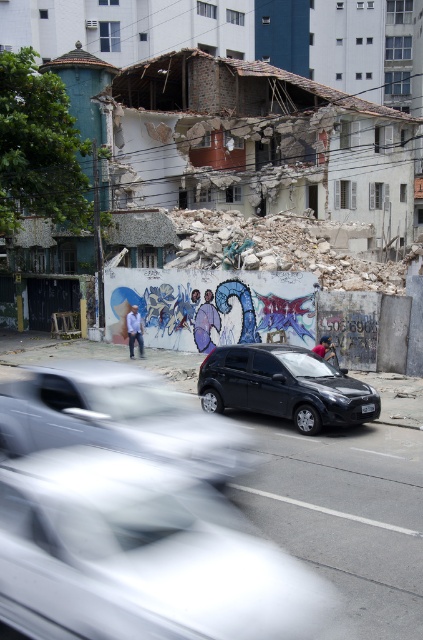
From the picture: Can you confirm if white glossy car at center is positioned to the left of metallic silver car at center?

In fact, white glossy car at center is to the right of metallic silver car at center.

Between point (195, 497) and point (24, 451), which one is positioned behind?

The point (24, 451) is more distant.

Locate an element on the screen. The width and height of the screenshot is (423, 640). white glossy car at center is located at coordinates (140, 557).

Which is in front, point (156, 394) or point (313, 378)?

Point (156, 394) is more forward.

Between metallic silver car at center and black matte hatchback at center, which one has more height?

black matte hatchback at center is taller.

Which is behind, point (132, 448) or point (367, 396)?

The point (367, 396) is more distant.

This screenshot has width=423, height=640. I want to click on metallic silver car at center, so click(x=120, y=419).

Locate an element on the screen. This screenshot has width=423, height=640. white glossy car at center is located at coordinates (140, 557).

Is white glossy car at center in front of black matte hatchback at center?

Yes, white glossy car at center is in front of black matte hatchback at center.

The image size is (423, 640). I want to click on white glossy car at center, so click(140, 557).